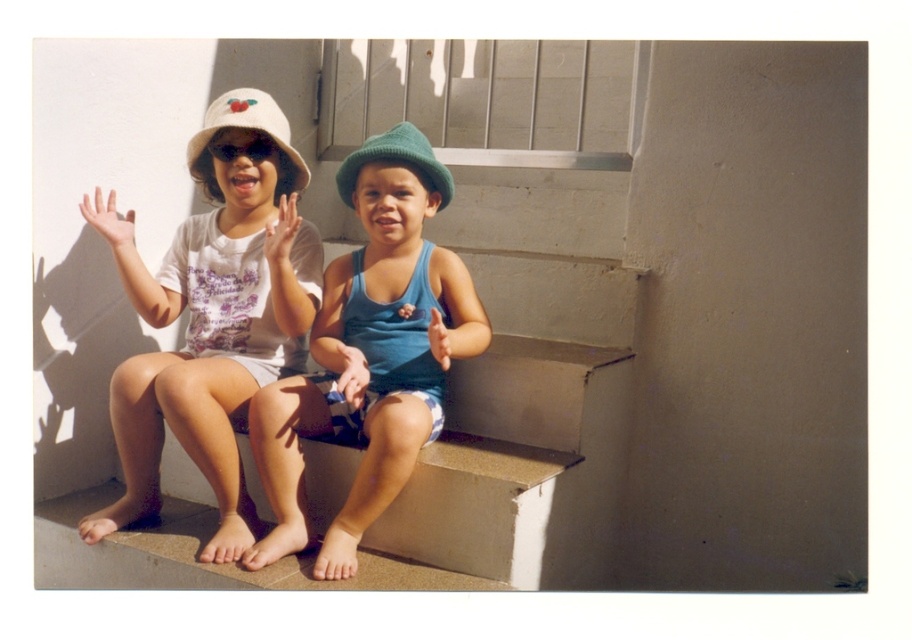
Question: Which object is farther from the camera taking this photo?

Choices:
 (A) blue fabric tank top at center
 (B) smooth concrete stairs at center
 (C) smooth skin hand at center
 (D) smooth blue fabric at center

Answer: (D)

Question: Among these points, which one is farthest from the camera?

Choices:
 (A) (451, 342)
 (B) (382, 538)
 (C) (334, 369)
 (D) (293, 221)

Answer: (C)

Question: Does green knitted hat at center have a greater width compared to white matte hand at center?

Choices:
 (A) yes
 (B) no

Answer: (A)

Question: Does matte white hat at upper left appear over matte white hand at center?

Choices:
 (A) no
 (B) yes

Answer: (A)

Question: Is green knitted hat at center below matte white hand at center?

Choices:
 (A) no
 (B) yes

Answer: (A)

Question: Which point appears closest to the camera in this image?

Choices:
 (A) (197, 474)
 (B) (219, 104)

Answer: (B)